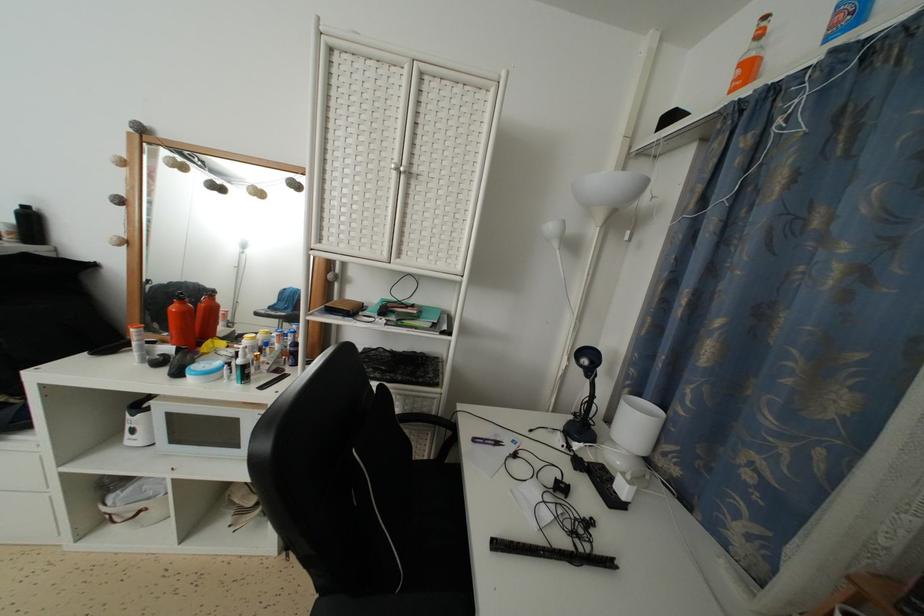
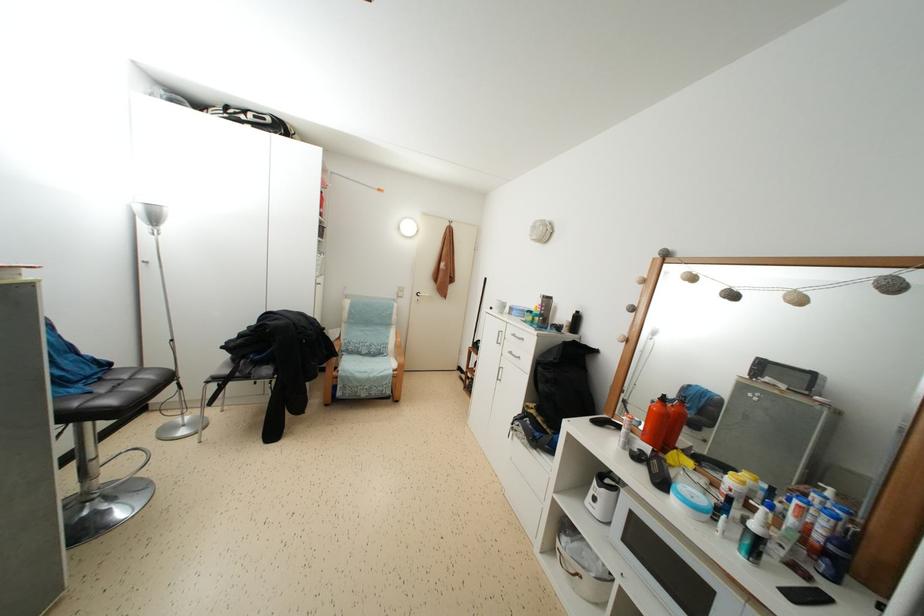
Locate, in the second image, the point that corresponds to point 280,310 in the first image.

(677, 406)